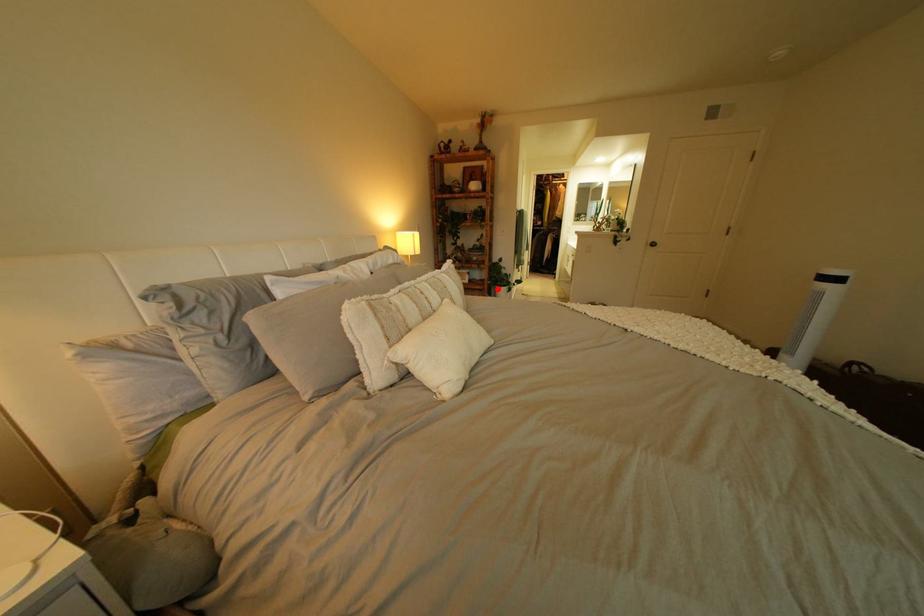
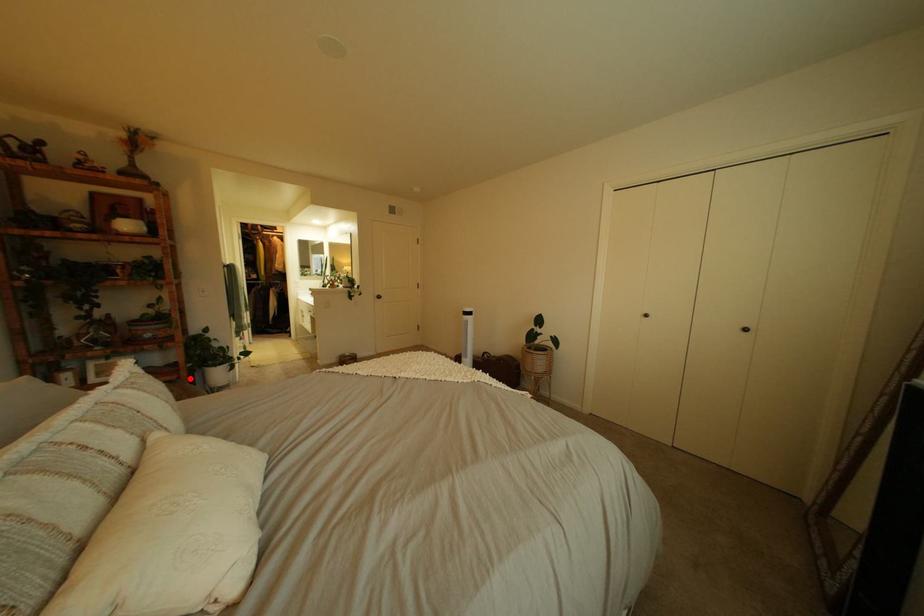
I am providing you with two images of the same scene from different viewpoints. A red point is marked on the first image and another point is marked on the second image. Are the points marked in image1 and image2 representing the same 3D position?

Yes